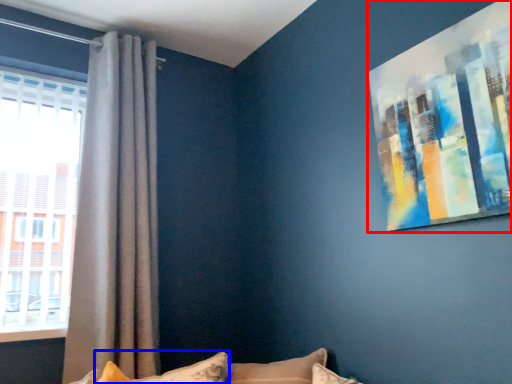
Question: Which object appears closest to the camera in this image, picture frame (highlighted by a red box) or pillow (highlighted by a blue box)?

Choices:
 (A) picture frame
 (B) pillow

Answer: (A)